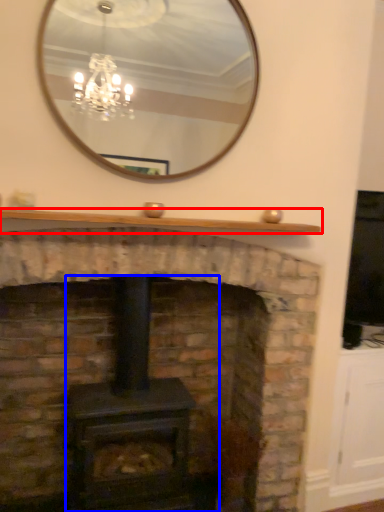
Question: Among these objects, which one is nearest to the camera, mantle (highlighted by a red box) or wood burning stove (highlighted by a blue box)?

Choices:
 (A) mantle
 (B) wood burning stove

Answer: (A)